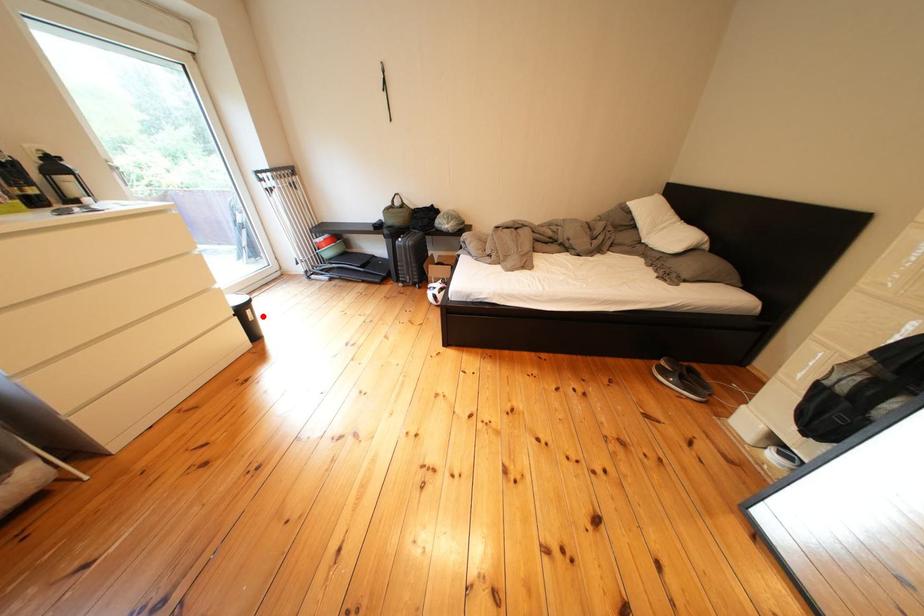
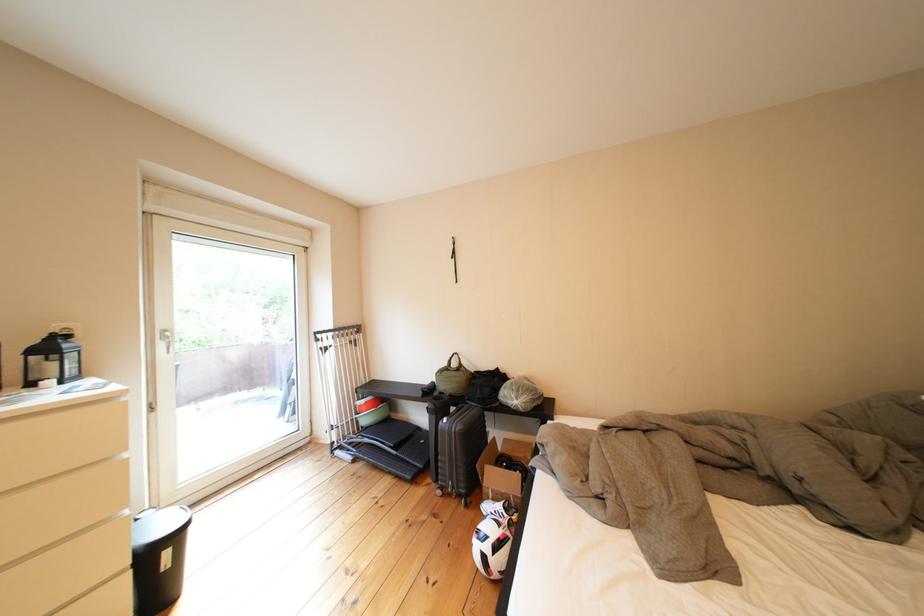
Locate, in the second image, the point that corresponds to the highlighted location in the first image.

(179, 557)